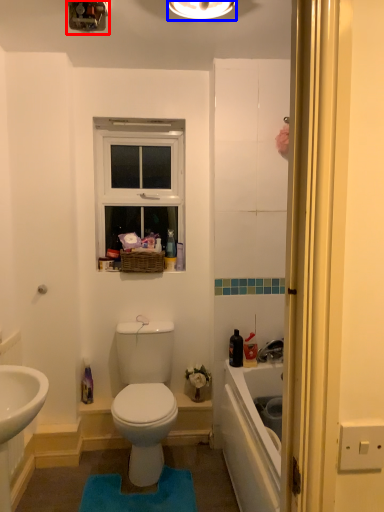
Question: Which point is closer to the camera, light fixture (highlighted by a red box) or light fixture (highlighted by a blue box)?

Choices:
 (A) light fixture
 (B) light fixture

Answer: (B)